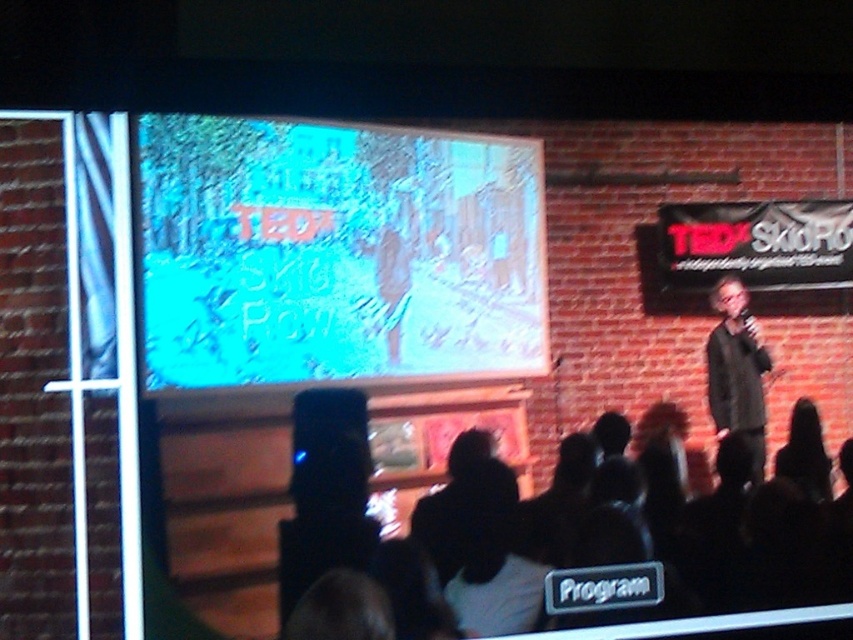
You are an event organizer who needs to decide whether to place a small decorative item on the black fabric at lower center or the dark gray sweater at right. Based on their sizes, which surface would be more suitable for the item?

The black fabric at lower center has a larger size compared to the dark gray sweater at right, so it would be more suitable for placing the small decorative item as it provides a larger surface area.

You are an event organizer who wants to place a promotional banner on the stage. The banner is 2 meters wide. You see the blue glossy screen at upper center and the black fabric at lower center. Which object can accommodate the banner without exceeding its width?

The black fabric at lower center can accommodate the banner since its width is greater than the blue glossy screen at upper center.

You are sitting in the audience at the TEDx SkiRoo event and want to know which of the two points, point (x=241, y=374) or point (x=724, y=340), is closer to you. Based on the scene description, which point is nearer?

Point (x=241, y=374) is closer to the camera than point (x=724, y=340), so it is nearer to you as an audience member.